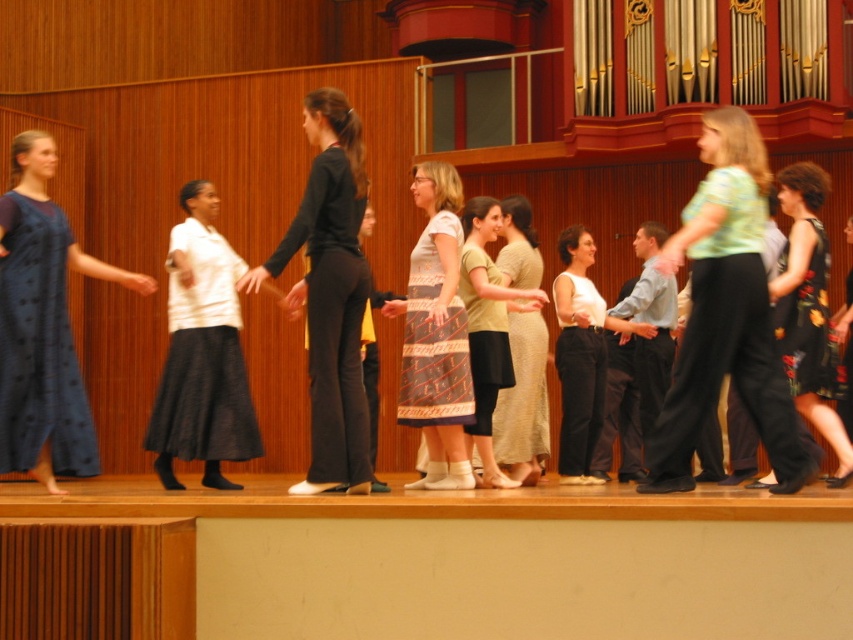
Can you confirm if white cotton blouse at center is wider than floral-patterned fabric dress at right?

Correct, the width of white cotton blouse at center exceeds that of floral-patterned fabric dress at right.

Where is `white cotton blouse at center`? white cotton blouse at center is located at coordinates (581, 355).

You are a GUI agent. You are given a task and a screenshot of the screen. Output one action in this format:
    pyautogui.click(x=<x>, y=<y>)
    Task: Click on the white cotton blouse at center
    
    Given the screenshot: What is the action you would take?
    (581, 355)

Can you confirm if dark blue dotted dress at left is thinner than white cotton blouse at center?

Yes, dark blue dotted dress at left is thinner than white cotton blouse at center.

Is point (45, 321) closer to viewer compared to point (560, 292)?

Yes, it is.

The width and height of the screenshot is (853, 640). What are the coordinates of `dark blue dotted dress at left` in the screenshot? It's located at (39, 346).

Is black smooth pants at center positioned behind light beige linen dress at center?

No.

Is point (357, 209) farther from viewer compared to point (519, 253)?

That is False.

Find the location of a particular element. black smooth pants at center is located at coordinates (329, 292).